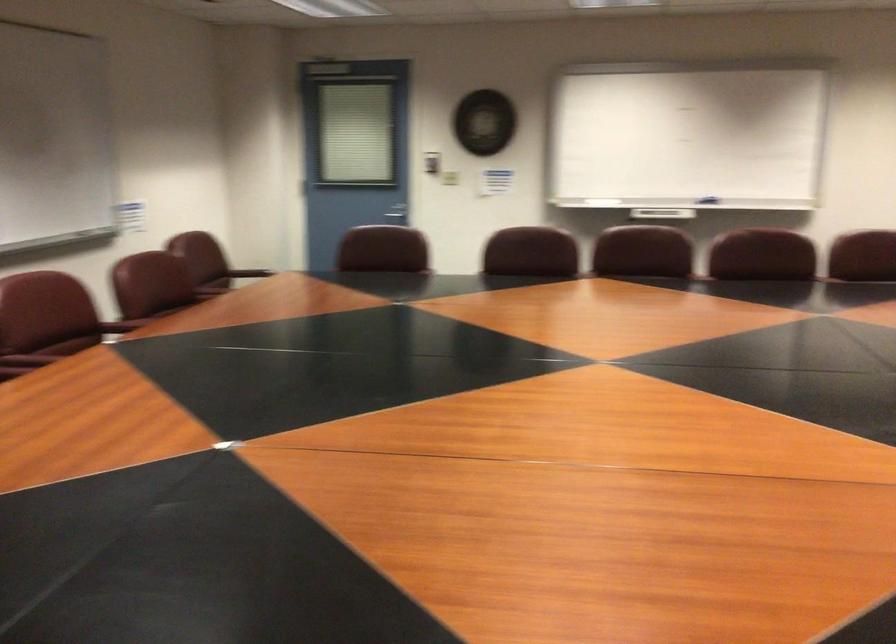
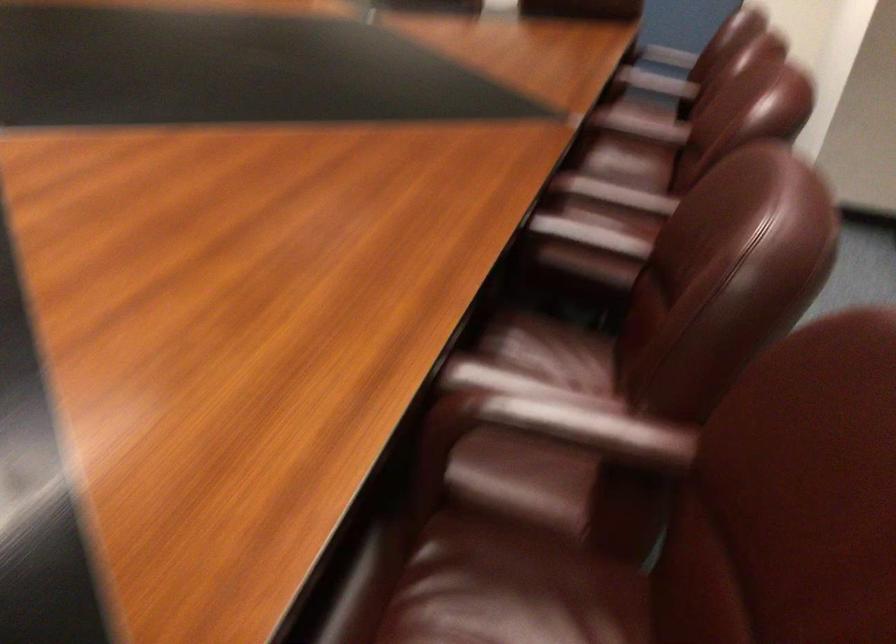
Where in the second image is the point corresponding to (160,307) from the first image?

(590, 236)